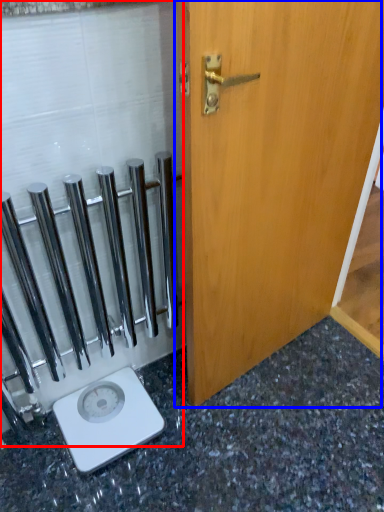
Question: Which point is closer to the camera, glass door (highlighted by a red box) or door (highlighted by a blue box)?

Choices:
 (A) glass door
 (B) door

Answer: (B)